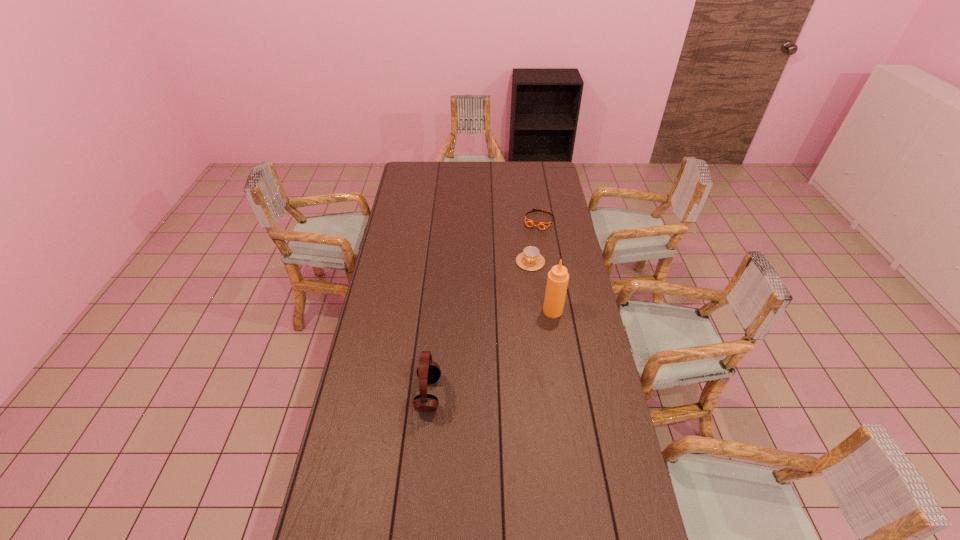
Locate an element on the screen. The height and width of the screenshot is (540, 960). blank space at the left edge of the desktop is located at coordinates (365, 363).

In the image, there is a desktop. Find the location of `vacant space at the right edge`. vacant space at the right edge is located at coordinates (564, 246).

Where is `vacant region between the cup and the condiment`? This screenshot has height=540, width=960. vacant region between the cup and the condiment is located at coordinates pyautogui.click(x=541, y=286).

Find the location of a particular element. unoccupied position between the farthest object and the nearest object is located at coordinates pyautogui.click(x=484, y=307).

I want to click on free space between the shortest object and the third farthest object, so click(x=546, y=266).

At what (x,y) coordinates should I click in order to perform the action: click on free area in between the headset and the cup. Please return your answer as a coordinate pair (x, y). Looking at the image, I should click on (479, 328).

Where is `free space that is in between the tallest object and the cup`? This screenshot has width=960, height=540. free space that is in between the tallest object and the cup is located at coordinates pyautogui.click(x=541, y=286).

At what (x,y) coordinates should I click in order to perform the action: click on vacant space that's between the nearest object and the second shortest object. Please return your answer as a coordinate pair (x, y). This screenshot has width=960, height=540. Looking at the image, I should click on (479, 328).

I want to click on free space between the farthest object and the third shortest object, so click(x=484, y=307).

I want to click on unoccupied position between the tallest object and the cup, so click(541, 286).